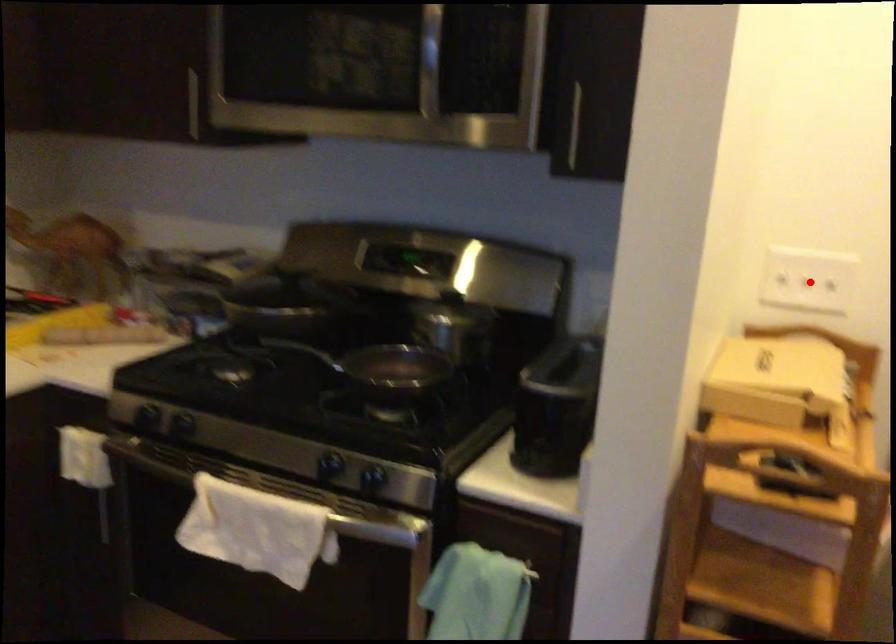
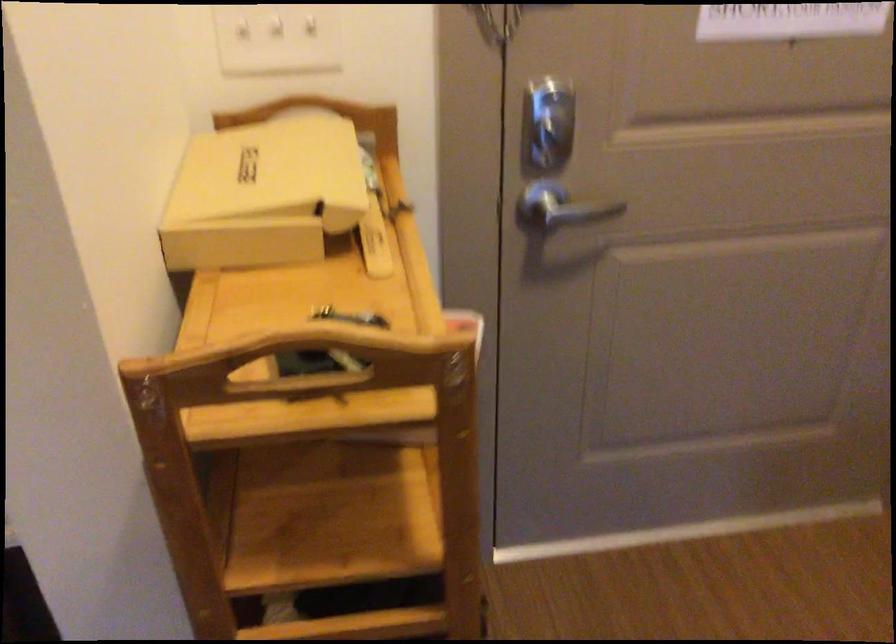
Question: I am providing you with two images of the same scene from different viewpoints. Image1 has a red point marked. In image2, the corresponding 3D location appears at what relative position? Reply with the corresponding letter.

Choices:
 (A) Closer
 (B) Farther

Answer: (A)